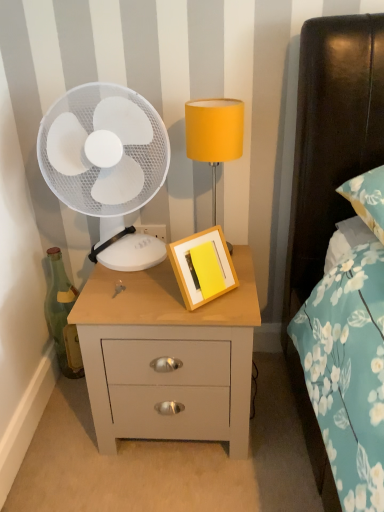
Question: Considering the relative sizes of light wood/finish nightstand at center and yellow fabric lampshade at upper center in the image provided, is light wood/finish nightstand at center shorter than yellow fabric lampshade at upper center?

Choices:
 (A) yes
 (B) no

Answer: (B)

Question: Is light wood/finish nightstand at center closer to the viewer compared to yellow fabric lampshade at upper center?

Choices:
 (A) yes
 (B) no

Answer: (A)

Question: Is light wood/finish nightstand at center further to camera compared to yellow fabric lampshade at upper center?

Choices:
 (A) no
 (B) yes

Answer: (A)

Question: Does light wood/finish nightstand at center contain yellow fabric lampshade at upper center?

Choices:
 (A) yes
 (B) no

Answer: (B)

Question: From the image's perspective, is light wood/finish nightstand at center below yellow fabric lampshade at upper center?

Choices:
 (A) no
 (B) yes

Answer: (B)

Question: From a real-world perspective, is wooden picture frame at center above or below yellow fabric lampshade at upper center?

Choices:
 (A) below
 (B) above

Answer: (A)

Question: Looking at the image, does wooden picture frame at center seem bigger or smaller compared to yellow fabric lampshade at upper center?

Choices:
 (A) big
 (B) small

Answer: (B)

Question: Based on their positions, is wooden picture frame at center located to the left or right of yellow fabric lampshade at upper center?

Choices:
 (A) right
 (B) left

Answer: (B)

Question: Considering the positions of point (228, 275) and point (211, 186), is point (228, 275) closer or farther from the camera than point (211, 186)?

Choices:
 (A) closer
 (B) farther

Answer: (A)

Question: From a real-world perspective, relative to white plastic fan at left, is light wood/finish nightstand at center vertically above or below?

Choices:
 (A) above
 (B) below

Answer: (B)

Question: In terms of height, does light wood/finish nightstand at center look taller or shorter compared to white plastic fan at left?

Choices:
 (A) tall
 (B) short

Answer: (B)

Question: Considering their positions, is light wood/finish nightstand at center located in front of or behind white plastic fan at left?

Choices:
 (A) front
 (B) behind

Answer: (A)

Question: Considering the positions of light wood/finish nightstand at center and white plastic fan at left in the image, is light wood/finish nightstand at center bigger or smaller than white plastic fan at left?

Choices:
 (A) small
 (B) big

Answer: (B)

Question: Is wooden picture frame at center to the left or to the right of green glass bottle at left in the image?

Choices:
 (A) right
 (B) left

Answer: (A)

Question: Is wooden picture frame at center wider or thinner than green glass bottle at left?

Choices:
 (A) thin
 (B) wide

Answer: (B)